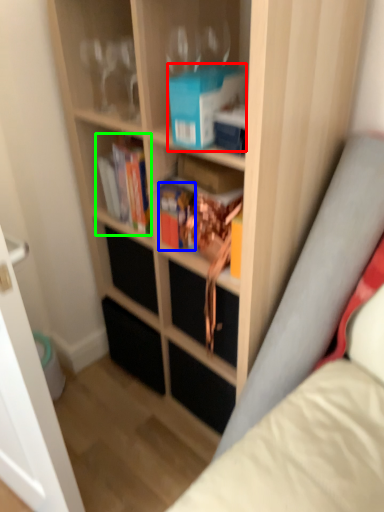
Question: Which is farther away from paperback book (highlighted by a red box)? book (highlighted by a blue box) or book (highlighted by a green box)?

Choices:
 (A) book
 (B) book

Answer: (B)